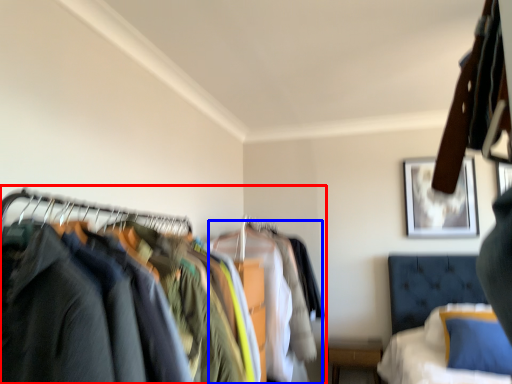
Question: Among these objects, which one is farthest to the camera, closet (highlighted by a red box) or clothing (highlighted by a blue box)?

Choices:
 (A) closet
 (B) clothing

Answer: (B)